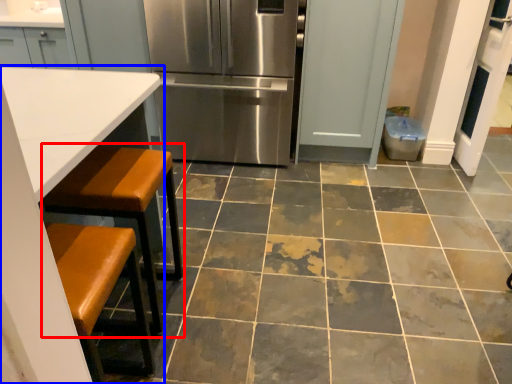
Question: Which object is further to the camera taking this photo, step stool (highlighted by a red box) or table (highlighted by a blue box)?

Choices:
 (A) step stool
 (B) table

Answer: (A)